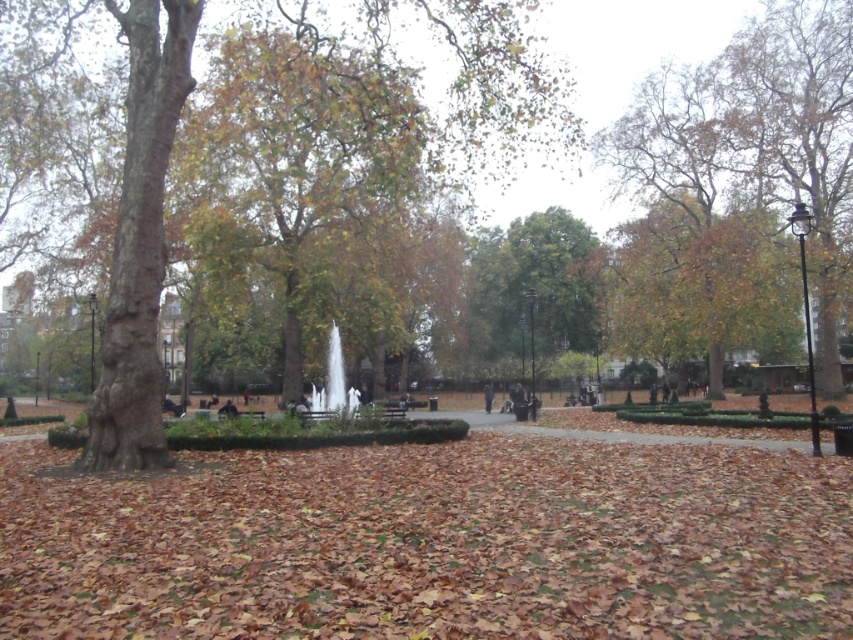
Question: Considering the relative positions of brown leafy tree at upper right and green leafy tree at center in the image provided, where is brown leafy tree at upper right located with respect to green leafy tree at center?

Choices:
 (A) below
 (B) above

Answer: (B)

Question: Which of the following is the closest to the observer?

Choices:
 (A) dark gray jacket at center
 (B) brown leafy tree at upper right
 (C) white marble fountain at center
 (D) green leafy tree at center

Answer: (C)

Question: Is brown leafy tree at upper right in front of green leafy tree at center?

Choices:
 (A) yes
 (B) no

Answer: (A)

Question: Is brown leaf litter at center smaller than dark gray jacket at center?

Choices:
 (A) no
 (B) yes

Answer: (A)

Question: Among these points, which one is nearest to the camera?

Choices:
 (A) (489, 394)
 (B) (558, 275)
 (C) (13, 454)

Answer: (C)

Question: Which of the following is the closest to the observer?

Choices:
 (A) green leafy tree at center
 (B) dark gray jacket at center
 (C) brown leaf litter at center
 (D) brown leafy tree at upper right

Answer: (C)